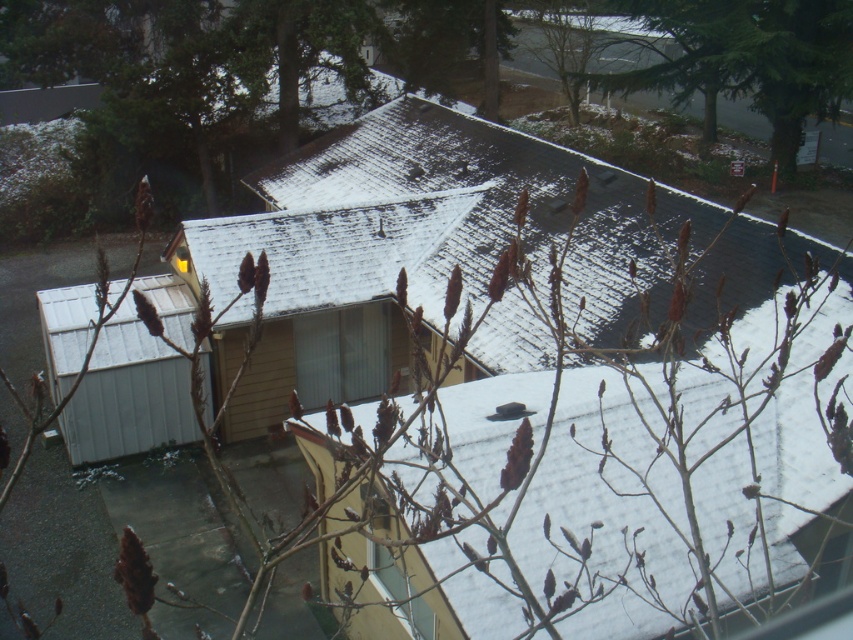
You are a delivery person trying to deliver a package to the wooden cabin at center. You see the green textured tree at upper right nearby. Which one is taller?

The wooden cabin at center is taller than the green textured tree at upper right.

You are a delivery person trying to navigate to the house in the image. There is a green textured tree at upper right marked by point (x=747, y=60). Can you describe the location of the tree relative to the house?

The green textured tree at upper right marked by point (x=747, y=60) is located at the upper right corner of the image, which is outside the house structure.

Based on the photo, you are a delivery person trying to park your van between the wooden cabin at center and the metallic gray shed at left. The van is 6 meters long. Can you fit it there?

The wooden cabin at center is larger in size than metallic gray shed at left, but the exact distance between them isn not provided. Without knowing the space between the two structures, it is impossible to determine if the van will fit.